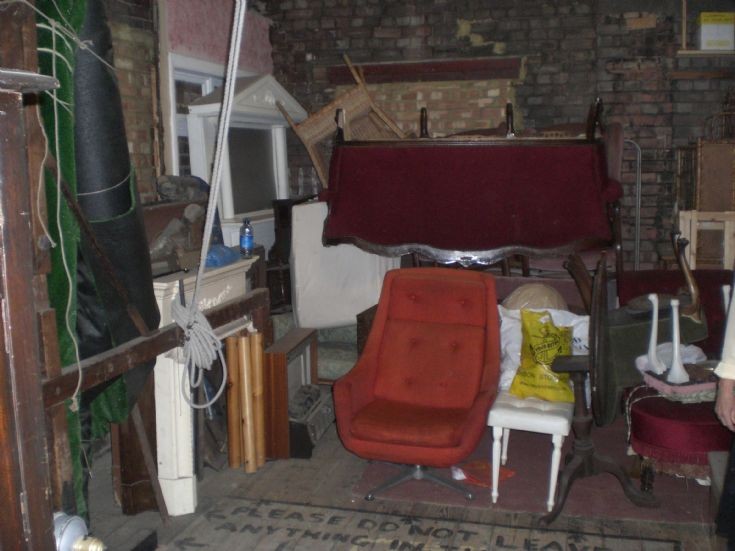
I want to click on flat top of the wooden table base on the right, so click(x=575, y=363).